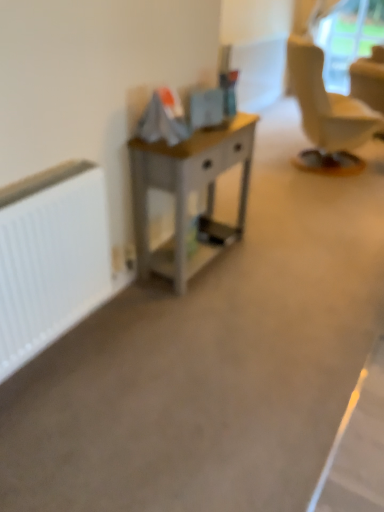
At what (x,y) coordinates should I click in order to perform the action: click on vacant area that lies between wooden desk at center and white matte radiator at left. Please return your answer as a coordinate pair (x, y). Looking at the image, I should click on (122, 322).